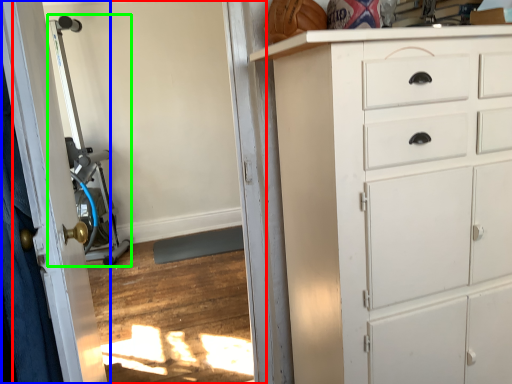
Question: Which object is positioned closest to screen door (highlighted by a red box)? Select from door (highlighted by a blue box) and sport equipment (highlighted by a green box).

Choices:
 (A) door
 (B) sport equipment

Answer: (A)